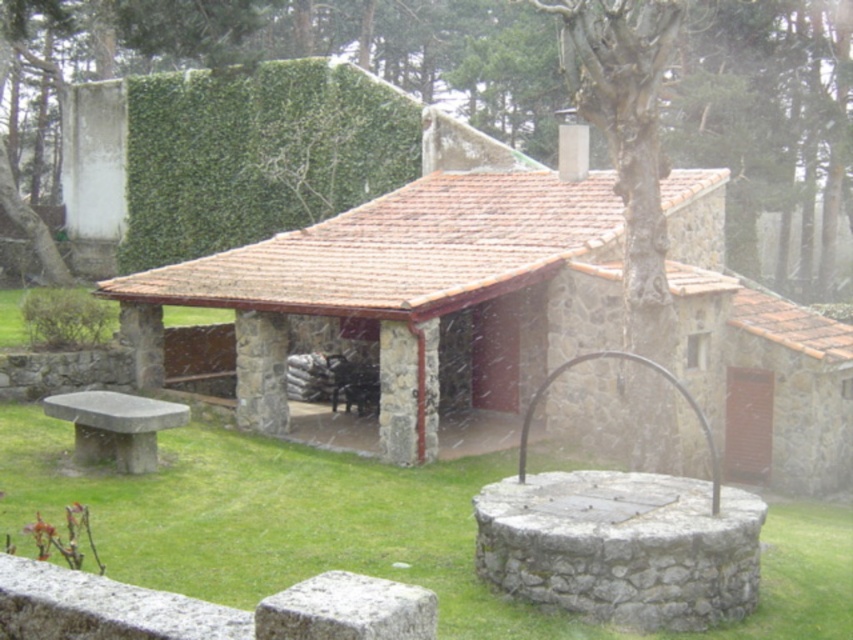
Who is lower down, green leafy tree at upper center or smooth stone bench at lower left?

Positioned lower is smooth stone bench at lower left.

Based on the photo, is green leafy tree at upper center bigger than smooth stone bench at lower left?

Correct, green leafy tree at upper center is larger in size than smooth stone bench at lower left.

Does point (106, 72) come in front of point (138, 436)?

No.

I want to click on green leafy tree at upper center, so click(x=305, y=49).

Is point (561, 406) closer to viewer compared to point (722, 84)?

Yes, point (561, 406) is closer to viewer.

The width and height of the screenshot is (853, 640). I want to click on stone roof hut at center, so click(422, 266).

Does stone roof hut at center have a smaller size compared to smooth stone bench at lower left?

Actually, stone roof hut at center might be larger than smooth stone bench at lower left.

This screenshot has height=640, width=853. In order to click on stone roof hut at center in this screenshot , I will do `click(422, 266)`.